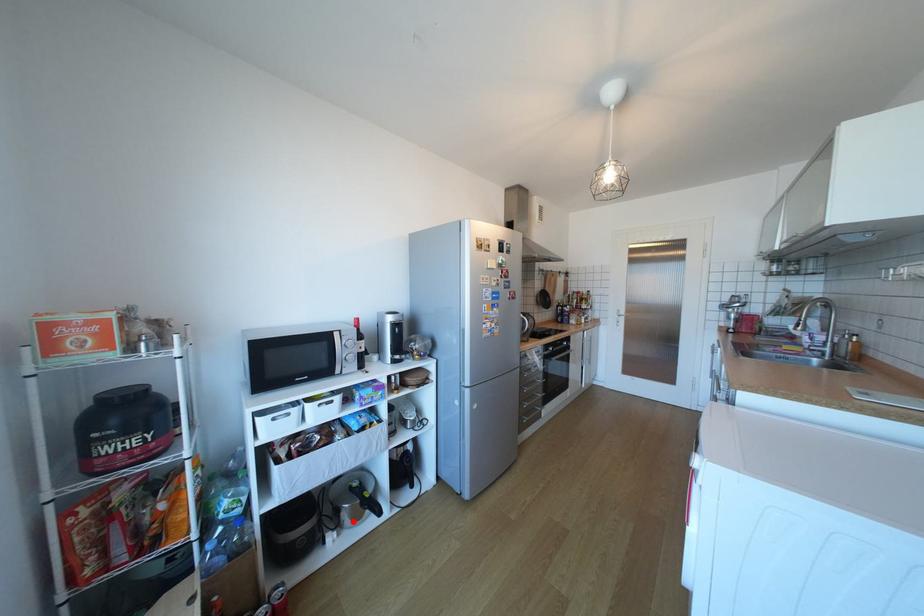
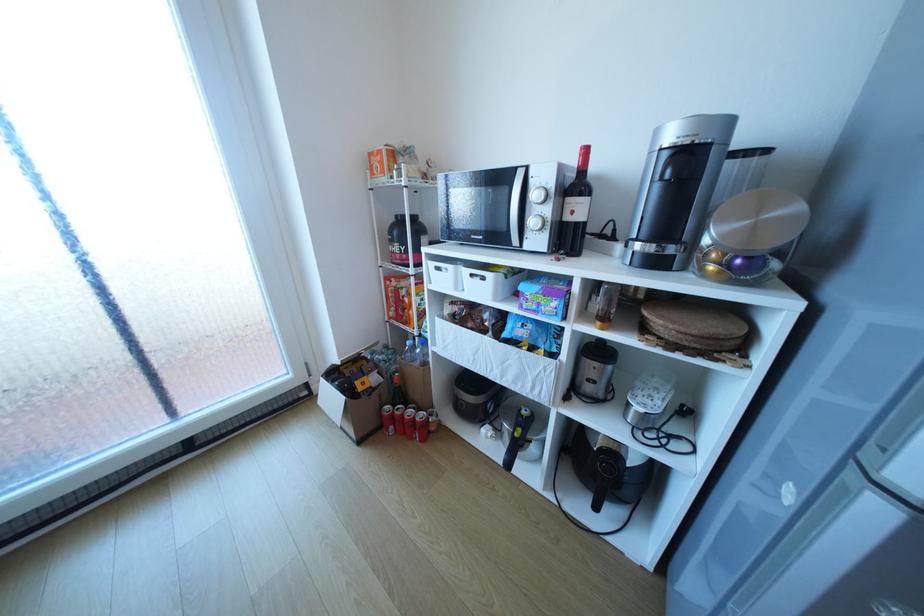
The point at the highlighted location is marked in the first image. Where is the corresponding point in the second image?

(513, 434)